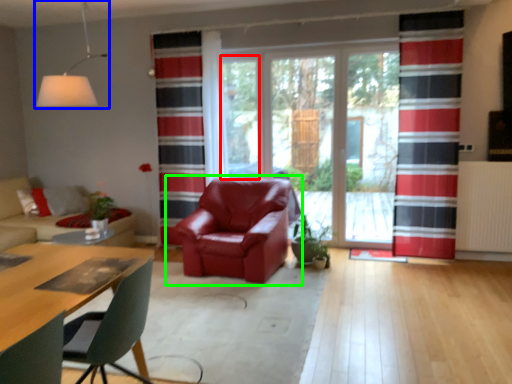
Question: Which object is positioned farthest from window screen (highlighted by a red box)? Select from light fixture (highlighted by a blue box) and chair (highlighted by a green box).

Choices:
 (A) light fixture
 (B) chair

Answer: (A)